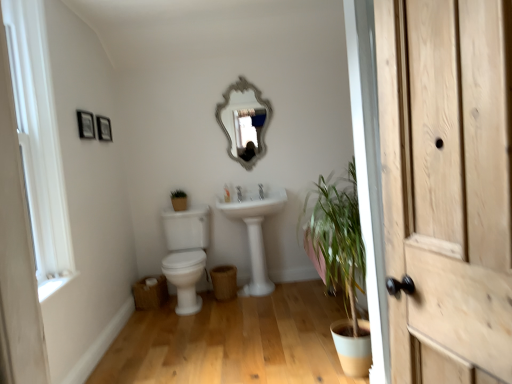
Question: Should I look upward or downward to see white glossy toilet at lower left?

Choices:
 (A) up
 (B) down

Answer: (B)

Question: Is white glossy sink at center wider than wooden picture frame at upper left, arranged as the 2th picture frame when viewed from the back?

Choices:
 (A) no
 (B) yes

Answer: (B)

Question: Is white glossy sink at center positioned beyond the bounds of wooden picture frame at upper left, positioned as the first picture frame in front-to-back order?

Choices:
 (A) yes
 (B) no

Answer: (A)

Question: Does white glossy sink at center touch wooden picture frame at upper left, positioned as the first picture frame in front-to-back order?

Choices:
 (A) no
 (B) yes

Answer: (A)

Question: Is white glossy sink at center thinner than wooden picture frame at upper left, positioned as the first picture frame in front-to-back order?

Choices:
 (A) no
 (B) yes

Answer: (A)

Question: Is white glossy sink at center far from wooden picture frame at upper left, arranged as the 2th picture frame when viewed from the back?

Choices:
 (A) no
 (B) yes

Answer: (B)

Question: Is wooden picture frame at upper left, positioned as the first picture frame in front-to-back order, completely or partially inside white glossy sink at center?

Choices:
 (A) yes
 (B) no

Answer: (B)

Question: From a real-world perspective, is white painted wood window frame at left under white ceramic tap at center?

Choices:
 (A) no
 (B) yes

Answer: (A)

Question: Is white painted wood window frame at left to the left of white ceramic tap at center from the viewer's perspective?

Choices:
 (A) no
 (B) yes

Answer: (B)

Question: Is white painted wood window frame at left facing away from white ceramic tap at center?

Choices:
 (A) yes
 (B) no

Answer: (B)

Question: Does white painted wood window frame at left have a greater width compared to white ceramic tap at center?

Choices:
 (A) no
 (B) yes

Answer: (B)

Question: Does white painted wood window frame at left appear on the right side of white ceramic tap at center?

Choices:
 (A) no
 (B) yes

Answer: (A)

Question: Does white painted wood window frame at left have a lesser height compared to white ceramic tap at center?

Choices:
 (A) no
 (B) yes

Answer: (A)

Question: Is white painted wood window frame at left further to the viewer compared to silver/glass mirror at upper center?

Choices:
 (A) no
 (B) yes

Answer: (A)